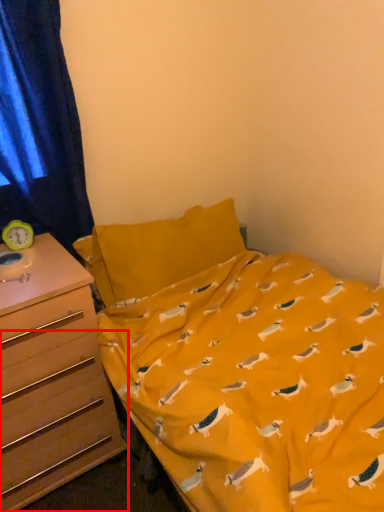
Question: From the image, what is the correct spatial relationship of drawer (annotated by the red box) in relation to curtain?

Choices:
 (A) left
 (B) right

Answer: (A)